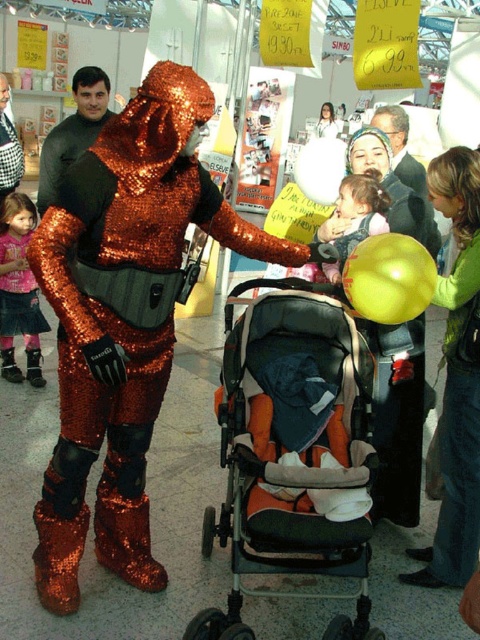
The height and width of the screenshot is (640, 480). Describe the element at coordinates (292, 452) in the screenshot. I see `orange fabric baby carriage at center` at that location.

Does orange fabric baby carriage at center appear on the left side of matte black jacket at upper right?

Indeed, orange fabric baby carriage at center is positioned on the left side of matte black jacket at upper right.

The image size is (480, 640). What do you see at coordinates (292, 452) in the screenshot?
I see `orange fabric baby carriage at center` at bounding box center [292, 452].

Locate an element on the screen. This screenshot has height=640, width=480. orange fabric baby carriage at center is located at coordinates (292, 452).

Which is above, matte pink shirt at lower left or shiny metallic costume at center?

shiny metallic costume at center is higher up.

Between matte pink shirt at lower left and shiny metallic costume at center, which one appears on the left side from the viewer's perspective?

matte pink shirt at lower left

Describe the element at coordinates (19, 291) in the screenshot. I see `matte pink shirt at lower left` at that location.

This screenshot has height=640, width=480. Identify the location of matte pink shirt at lower left. (19, 291).

Which of these two, shiny metallic costume at center or matte orange costume at center, stands shorter?

Standing shorter between the two is matte orange costume at center.

Can you confirm if shiny metallic costume at center is positioned below matte orange costume at center?

Incorrect, shiny metallic costume at center is not positioned below matte orange costume at center.

The height and width of the screenshot is (640, 480). What do you see at coordinates (263, 138) in the screenshot?
I see `shiny metallic costume at center` at bounding box center [263, 138].

Locate an element on the screen. shiny metallic costume at center is located at coordinates (263, 138).